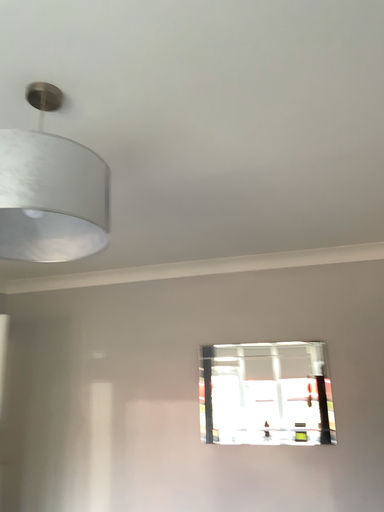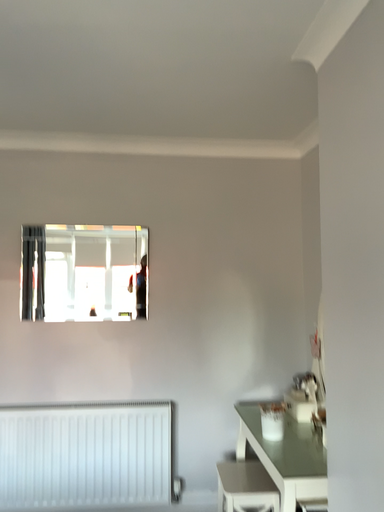
Question: How did the camera likely rotate when shooting the video?

Choices:
 (A) rotated left
 (B) rotated right

Answer: (B)